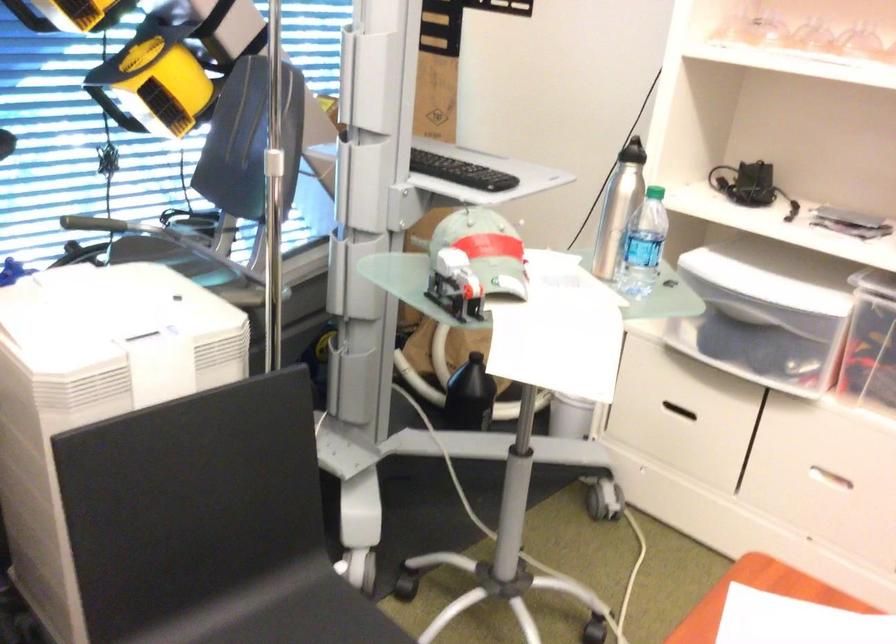
Where would you sit the black chair sitting surface? Please return your answer as a coordinate pair (x, y).

(270, 623)